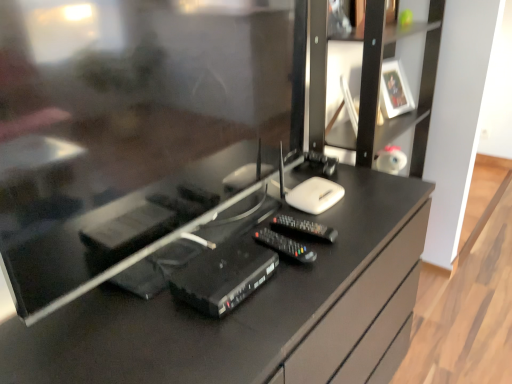
Locate an element on the screen. The width and height of the screenshot is (512, 384). free space between black plastic remote control at center, the 2th equipment positioned from the left, and black plastic remote at center is located at coordinates (319, 249).